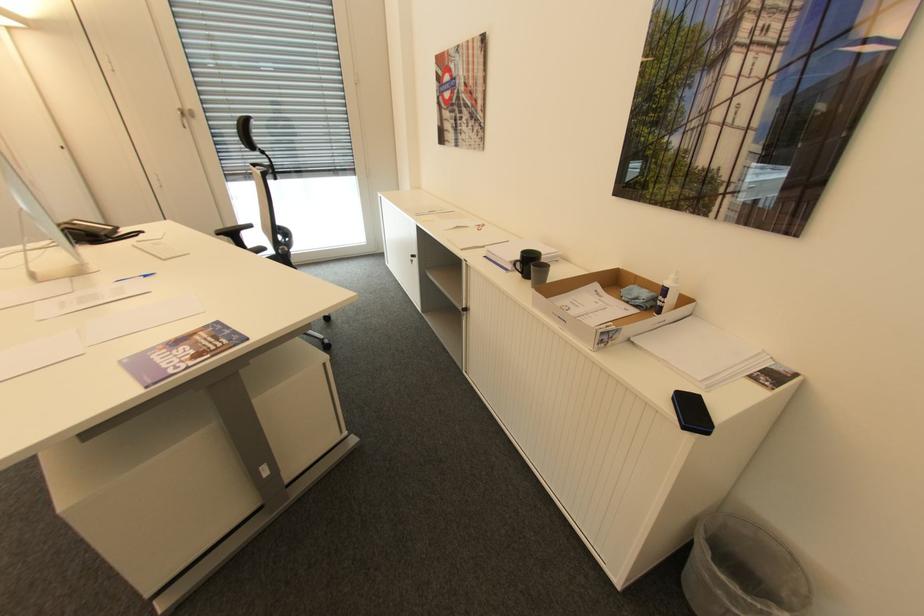
Where is `silver door handle`? Image resolution: width=924 pixels, height=616 pixels. silver door handle is located at coordinates (412, 261).